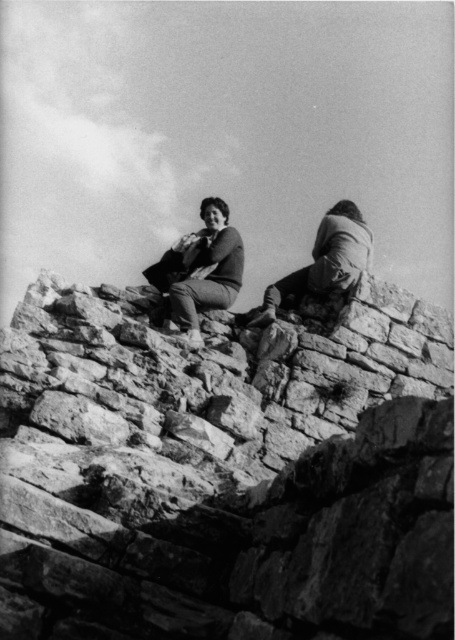
Between rough stone wall at center and smooth fabric jacket at upper right, which one appears on the right side from the viewer's perspective?

Positioned to the right is smooth fabric jacket at upper right.

Can you confirm if rough stone wall at center is positioned above smooth fabric jacket at upper right?

No, rough stone wall at center is not above smooth fabric jacket at upper right.

Describe the element at coordinates (222, 476) in the screenshot. I see `rough stone wall at center` at that location.

The height and width of the screenshot is (640, 455). In order to click on rough stone wall at center in this screenshot , I will do `click(222, 476)`.

Between rough stone wall at center and smooth fabric bag at center, which one is positioned lower?

rough stone wall at center is lower down.

Which of these two, rough stone wall at center or smooth fabric bag at center, stands taller?

smooth fabric bag at center

Find the location of a particular element. Image resolution: width=455 pixels, height=640 pixels. rough stone wall at center is located at coordinates [x=222, y=476].

Find the location of a particular element. This screenshot has height=640, width=455. rough stone wall at center is located at coordinates (222, 476).

Between smooth fabric bag at center and smooth fabric jacket at upper right, which one is positioned lower?

smooth fabric jacket at upper right

Consider the image. Who is positioned more to the right, smooth fabric bag at center or smooth fabric jacket at upper right?

smooth fabric jacket at upper right is more to the right.

Where is `smooth fabric bag at center`? smooth fabric bag at center is located at coordinates (201, 269).